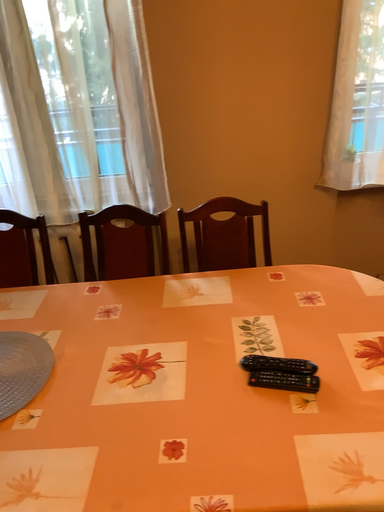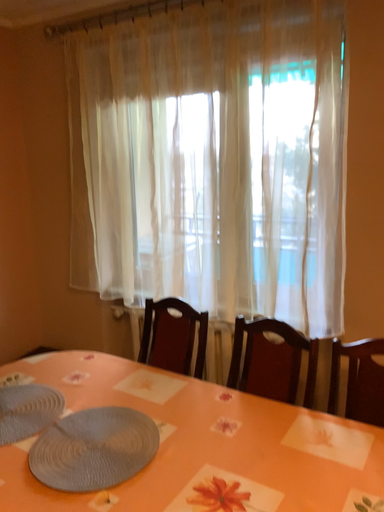
Question: Which way did the camera rotate in the video?

Choices:
 (A) rotated right
 (B) rotated left

Answer: (B)